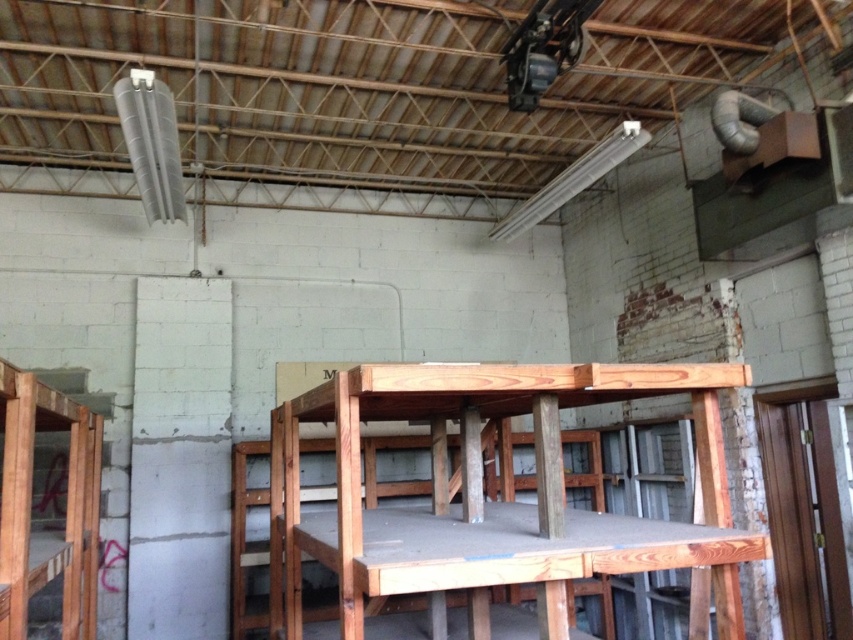
Is natural wood table at center behind wooden bunk bed at left?

No, natural wood table at center is closer to the viewer.

In the scene shown: Does natural wood table at center have a smaller size compared to wooden bunk bed at left?

Result: Incorrect, natural wood table at center is not smaller in size than wooden bunk bed at left.

At what (x,y) coordinates should I click in order to perform the action: click on natural wood table at center. Please return your answer as a coordinate pair (x, y). This screenshot has width=853, height=640. Looking at the image, I should click on (492, 500).